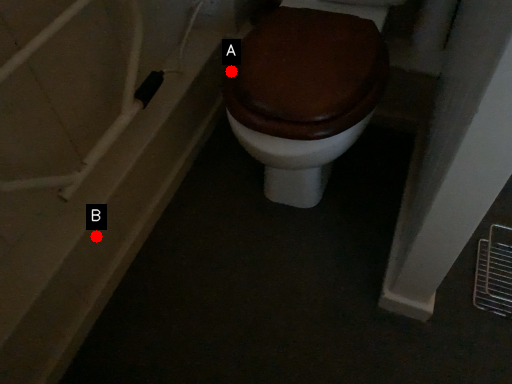
Question: Two points are circled on the image, labeled by A and B beside each circle. Which point appears farthest from the camera in this image?

Choices:
 (A) A is further
 (B) B is further

Answer: (B)